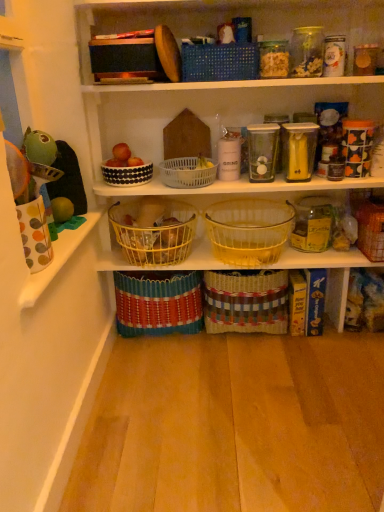
At what (x,y) coordinates should I click in order to perform the action: click on translucent glass basket at center, marked as the fourth basket in a top-to-bottom arrangement. Please return your answer as a coordinate pair (x, y). The height and width of the screenshot is (512, 384). Looking at the image, I should click on (249, 230).

Where is `transparent glass container at center, arranged as the 2th glass jar when ordered from the bottom`? transparent glass container at center, arranged as the 2th glass jar when ordered from the bottom is located at coordinates (262, 151).

Find the location of a particular element. This screenshot has width=384, height=512. woven fabric basket at center, positioned as the 8th basket in top-to-bottom order is located at coordinates (158, 303).

Where is `translucent glass basket at center, which is counted as the fifth basket, starting from the bottom`? The height and width of the screenshot is (512, 384). translucent glass basket at center, which is counted as the fifth basket, starting from the bottom is located at coordinates (249, 230).

Is yellow wire basket at center, which is the 3th basket in bottom-to-top order, next to transparent glass container at center, arranged as the 1th glass jar when viewed from the front, and touching it?

No, yellow wire basket at center, which is the 3th basket in bottom-to-top order, is not making contact with transparent glass container at center, arranged as the 1th glass jar when viewed from the front.

Which of these two, yellow wire basket at center, the 6th basket when ordered from top to bottom, or transparent glass container at center, arranged as the 2th glass jar when ordered from the bottom, is thinner?

transparent glass container at center, arranged as the 2th glass jar when ordered from the bottom, is thinner.

Measure the distance between yellow wire basket at center, which is the 3th basket in bottom-to-top order, and transparent glass container at center, the second glass jar in the back-to-front sequence.

They are 17.28 inches apart.

Considering the sizes of yellow wire basket at center, the 6th basket when ordered from top to bottom, and transparent glass container at center, arranged as the first glass jar when viewed from the left, in the image, is yellow wire basket at center, the 6th basket when ordered from top to bottom, taller or shorter than transparent glass container at center, arranged as the first glass jar when viewed from the left,?

Considering their sizes, yellow wire basket at center, the 6th basket when ordered from top to bottom, has less height than transparent glass container at center, arranged as the first glass jar when viewed from the left.

Considering the relative sizes of yellow wire basket at center, the 6th basket when ordered from top to bottom, and woven fabric basket at center, which is the first basket in bottom-to-top order, in the image provided, is yellow wire basket at center, the 6th basket when ordered from top to bottom, wider than woven fabric basket at center, which is the first basket in bottom-to-top order,?

Indeed, yellow wire basket at center, the 6th basket when ordered from top to bottom, has a greater width compared to woven fabric basket at center, which is the first basket in bottom-to-top order.

Is yellow wire basket at center, which is the 3th basket in bottom-to-top order, facing towards woven fabric basket at center, which is the first basket in bottom-to-top order?

Result: No, yellow wire basket at center, which is the 3th basket in bottom-to-top order, is not turned towards woven fabric basket at center, which is the first basket in bottom-to-top order.

Is yellow wire basket at center, the 6th basket when ordered from top to bottom, in front of woven fabric basket at center, positioned as the 8th basket in top-to-bottom order?

Yes, yellow wire basket at center, the 6th basket when ordered from top to bottom, is closer to the camera.

Can you confirm if yellow wire basket at center, which is the 3th basket in bottom-to-top order, is positioned to the right of woven fabric basket at center, which is the first basket in bottom-to-top order?

No.

Between woven brown basket at center, acting as the seventh basket starting from the top, and woven brown basket at lower right, marked as the fifth basket in a top-to-bottom arrangement, which one has more height?

With more height is woven brown basket at center, acting as the seventh basket starting from the top.

Between point (234, 313) and point (375, 225), which one is positioned in front?

Point (375, 225)

Consider the image. From the image's perspective, is woven brown basket at center, acting as the seventh basket starting from the top, above woven brown basket at lower right, marked as the fifth basket in a top-to-bottom arrangement?

Actually, woven brown basket at center, acting as the seventh basket starting from the top, appears below woven brown basket at lower right, marked as the fifth basket in a top-to-bottom arrangement, in the image.

Locate an element on the screen. This screenshot has height=512, width=384. basket that is the 2nd object located below the woven brown basket at lower right, marked as the fifth basket in a top-to-bottom arrangement (from the image's perspective) is located at coordinates (246, 301).

Looking at this image, is yellow wire basket at center, which is the 3th basket in bottom-to-top order, facing towards woven brown basket at lower right, marked as the fifth basket in a top-to-bottom arrangement?

No, yellow wire basket at center, which is the 3th basket in bottom-to-top order, is not facing towards woven brown basket at lower right, marked as the fifth basket in a top-to-bottom arrangement.

Considering the relative sizes of yellow wire basket at center, the 6th basket when ordered from top to bottom, and woven brown basket at lower right, marked as the fifth basket in a top-to-bottom arrangement, in the image provided, is yellow wire basket at center, the 6th basket when ordered from top to bottom, smaller than woven brown basket at lower right, marked as the fifth basket in a top-to-bottom arrangement,?

Actually, yellow wire basket at center, the 6th basket when ordered from top to bottom, might be larger than woven brown basket at lower right, marked as the fifth basket in a top-to-bottom arrangement.

Is yellow wire basket at center, the 6th basket when ordered from top to bottom, next to woven brown basket at lower right, placed as the 4th basket when sorted from bottom to top?

No, yellow wire basket at center, the 6th basket when ordered from top to bottom, is not in contact with woven brown basket at lower right, placed as the 4th basket when sorted from bottom to top.

Is point (154, 237) farther from camera compared to point (382, 244)?

No, (154, 237) is closer to viewer.

Is black dotted bowl at upper center, the 7th basket positioned from the bottom, bigger or smaller than translucent glass basket at center, which is counted as the fifth basket, starting from the bottom?

In the image, black dotted bowl at upper center, the 7th basket positioned from the bottom, appears to be smaller than translucent glass basket at center, which is counted as the fifth basket, starting from the bottom.

Relative to translucent glass basket at center, which is counted as the fifth basket, starting from the bottom, is black dotted bowl at upper center, which is counted as the second basket, starting from the top, in front or behind?

Clearly, black dotted bowl at upper center, which is counted as the second basket, starting from the top, is behind translucent glass basket at center, which is counted as the fifth basket, starting from the bottom.

Does black dotted bowl at upper center, the 7th basket positioned from the bottom, turn towards translucent glass basket at center, marked as the fourth basket in a top-to-bottom arrangement?

No, black dotted bowl at upper center, the 7th basket positioned from the bottom, is not facing towards translucent glass basket at center, marked as the fourth basket in a top-to-bottom arrangement.

Identify the location of the 2nd basket positioned below the transparent glass container at center, the first glass jar when ordered from top to bottom (from a real-world perspective). The image size is (384, 512). (188, 172).

Relative to transparent glass container at center, arranged as the 1th glass jar when viewed from the front, is white plastic basket at center, the third basket from the top, in front or behind?

white plastic basket at center, the third basket from the top, is behind transparent glass container at center, arranged as the 1th glass jar when viewed from the front.

Between white plastic basket at center, the third basket from the top, and transparent glass container at center, arranged as the 2th glass jar when ordered from the bottom, which one has more height?

transparent glass container at center, arranged as the 2th glass jar when ordered from the bottom.

Would you say white plastic basket at center, the third basket from the top, is a long distance from transparent glass container at center, the second glass jar in the back-to-front sequence?

That's not correct — white plastic basket at center, the third basket from the top, is a little close to transparent glass container at center, the second glass jar in the back-to-front sequence.

Does woven brown basket at lower right, placed as the 4th basket when sorted from bottom to top, have a greater height compared to woven brown basket at center, the 2th basket from the bottom?

In fact, woven brown basket at lower right, placed as the 4th basket when sorted from bottom to top, may be shorter than woven brown basket at center, the 2th basket from the bottom.

Would you say woven brown basket at lower right, placed as the 4th basket when sorted from bottom to top, contains woven brown basket at center, the 2th basket from the bottom?

No, woven brown basket at center, the 2th basket from the bottom, is located outside of woven brown basket at lower right, placed as the 4th basket when sorted from bottom to top.

Is point (369, 234) less distant than point (284, 303)?

Yes, it is in front of point (284, 303).

Could you tell me if woven brown basket at lower right, marked as the fifth basket in a top-to-bottom arrangement, is turned towards woven brown basket at center, the 2th basket from the bottom?

No, woven brown basket at lower right, marked as the fifth basket in a top-to-bottom arrangement, does not turn towards woven brown basket at center, the 2th basket from the bottom.

Image resolution: width=384 pixels, height=512 pixels. I want to click on the 2nd glass jar positioned above the yellow wire basket at center, the 6th basket when ordered from top to bottom (from the image's perspective), so tap(262, 151).

From a real-world perspective, which basket is the 3rd one above the woven fabric basket at center, which is the first basket in bottom-to-top order? Please provide its 2D coordinates.

[(154, 230)]

Looking at the image, which one is located closer to white plastic basket at center, the 6th basket positioned from the bottom, woven brown basket at lower right, marked as the fifth basket in a top-to-bottom arrangement, or translucent glass jar at center right, the 1th glass jar in the right-to-left sequence?

translucent glass jar at center right, the 1th glass jar in the right-to-left sequence, is closer to white plastic basket at center, the 6th basket positioned from the bottom.

Looking at the image, which one is located further to woven brown basket at center, the 2th basket from the bottom, yellow wire basket at center, the 6th basket when ordered from top to bottom, or translucent glass jar at center right, the 1th glass jar in the right-to-left sequence?

Based on the image, yellow wire basket at center, the 6th basket when ordered from top to bottom, appears to be further to woven brown basket at center, the 2th basket from the bottom.

Estimate the real-world distances between objects in this image. Which object is further from transparent glass container at center, the second glass jar when ordered from right to left, yellow wire basket at center, the 6th basket when ordered from top to bottom, or white plastic basket at center, the 6th basket positioned from the bottom?

Based on the image, yellow wire basket at center, the 6th basket when ordered from top to bottom, appears to be further to transparent glass container at center, the second glass jar when ordered from right to left.

Which object lies further to the anchor point white plastic basket at center, the third basket from the top, black dotted bowl at upper center, the 7th basket positioned from the bottom, or woven brown basket at center, acting as the seventh basket starting from the top?

Based on the image, woven brown basket at center, acting as the seventh basket starting from the top, appears to be further to white plastic basket at center, the third basket from the top.

Considering their positions, is woven fabric basket at center, which is the first basket in bottom-to-top order, positioned further to white plastic basket at center, the third basket from the top, than yellow wire basket at center, which is the 3th basket in bottom-to-top order?

Based on the image, woven fabric basket at center, which is the first basket in bottom-to-top order, appears to be further to white plastic basket at center, the third basket from the top.

From the image, which object appears to be nearer to white plastic basket at center, the 6th basket positioned from the bottom, blue woven basket at upper center, the 8th basket positioned from the bottom, or yellow wire basket at center, which is the 3th basket in bottom-to-top order?

Result: yellow wire basket at center, which is the 3th basket in bottom-to-top order, is closer to white plastic basket at center, the 6th basket positioned from the bottom.

Which object lies further to the anchor point black dotted bowl at upper center, the 7th basket positioned from the bottom, translucent glass jar at center right, which ranks as the first glass jar in bottom-to-top order, or woven brown basket at lower right, placed as the 4th basket when sorted from bottom to top?

The object further to black dotted bowl at upper center, the 7th basket positioned from the bottom, is woven brown basket at lower right, placed as the 4th basket when sorted from bottom to top.

Estimate the real-world distances between objects in this image. Which object is closer to woven brown basket at center, acting as the seventh basket starting from the top, woven fabric basket at center, which is the first basket in bottom-to-top order, or yellow wire basket at center, the 6th basket when ordered from top to bottom?

woven fabric basket at center, which is the first basket in bottom-to-top order, lies closer to woven brown basket at center, acting as the seventh basket starting from the top, than the other object.

You are a GUI agent. You are given a task and a screenshot of the screen. Output one action in this format:
    pyautogui.click(x=<x>, y=<y>)
    Task: Click on the glass jar between transparent glass container at center, arranged as the 1th glass jar when viewed from the front, and woven brown basket at lower right, marked as the fifth basket in a top-to-bottom arrangement, from left to right
    
    Given the screenshot: What is the action you would take?
    [313, 224]

Locate an element on the screen. This screenshot has height=512, width=384. glass jar between woven fabric basket at center, positioned as the 8th basket in top-to-bottom order, and translucent glass jar at center right, the 2th glass jar in the front-to-back sequence is located at coordinates [x=262, y=151].

You are a GUI agent. You are given a task and a screenshot of the screen. Output one action in this format:
    pyautogui.click(x=<x>, y=<y>)
    Task: Click on the glass jar between black dotted bowl at upper center, the 7th basket positioned from the bottom, and translucent glass jar at center right, which ranks as the first glass jar in bottom-to-top order
    Image resolution: width=384 pixels, height=512 pixels.
    Given the screenshot: What is the action you would take?
    pyautogui.click(x=262, y=151)

Locate an element on the screen. glass jar between yellow wire basket at center, the 6th basket when ordered from top to bottom, and translucent glass jar at center right, the 2th glass jar in the front-to-back sequence, in the horizontal direction is located at coordinates (262, 151).